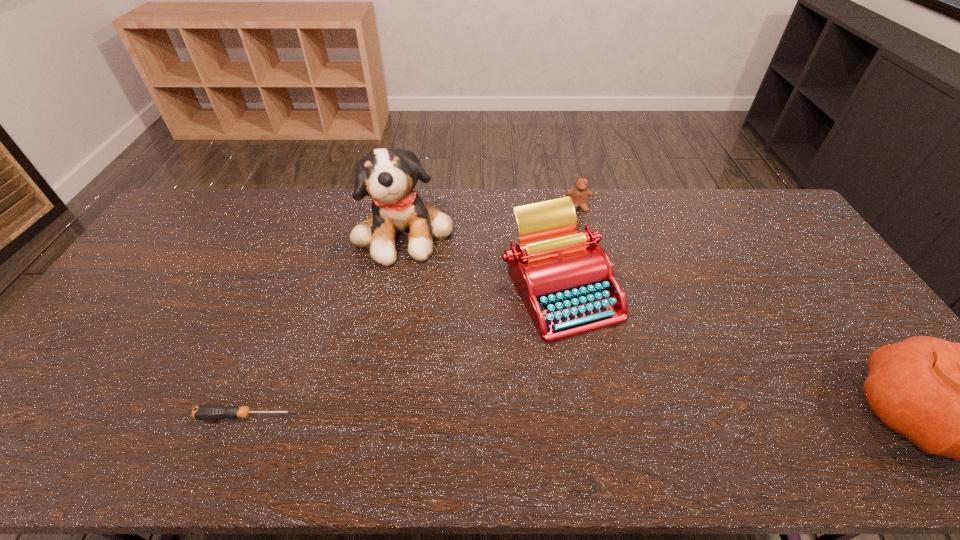
Locate an element on the screen. This screenshot has width=960, height=540. free space between the puppy and the screwdriver is located at coordinates (326, 323).

Where is `the second closest object to the fourth object from right to left`? The height and width of the screenshot is (540, 960). the second closest object to the fourth object from right to left is located at coordinates (579, 195).

This screenshot has height=540, width=960. I want to click on object that is the third closest to the puppy, so click(208, 411).